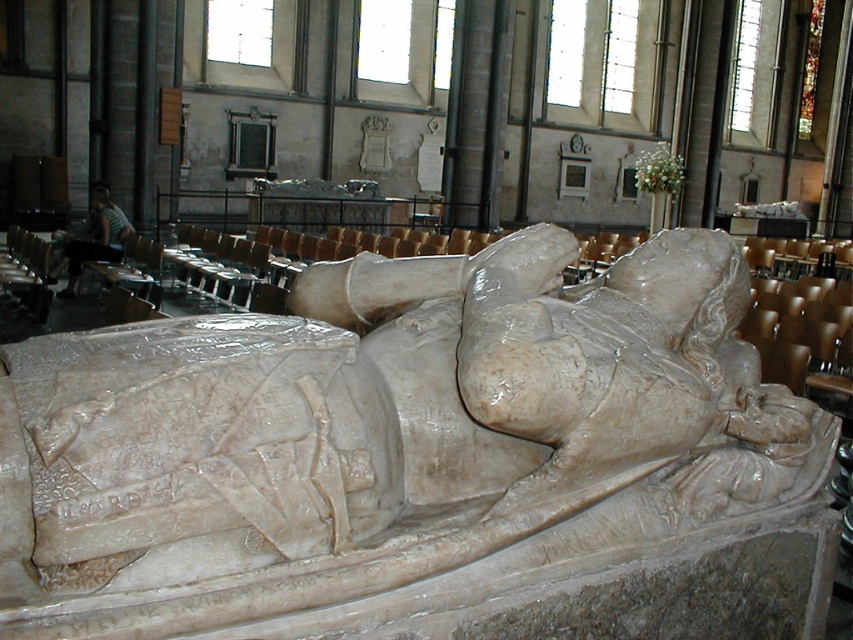
Question: Is white marble statue at center further to the viewer compared to light brown wooden chair at lower left?

Choices:
 (A) yes
 (B) no

Answer: (B)

Question: Can you confirm if white marble statue at center is positioned to the right of light brown wooden chair at lower left?

Choices:
 (A) yes
 (B) no

Answer: (A)

Question: Can you confirm if white marble statue at center is positioned below light brown wooden chair at lower left?

Choices:
 (A) no
 (B) yes

Answer: (B)